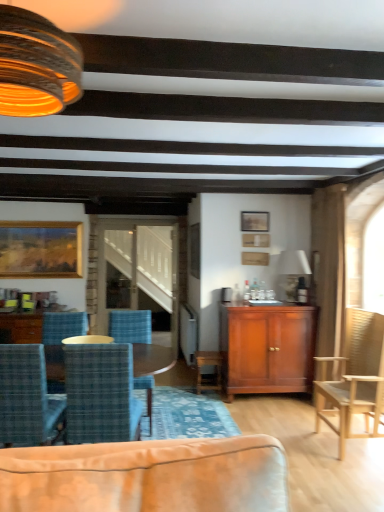
Identify the location of free space in front of matte wood cabinet at center. (270, 415).